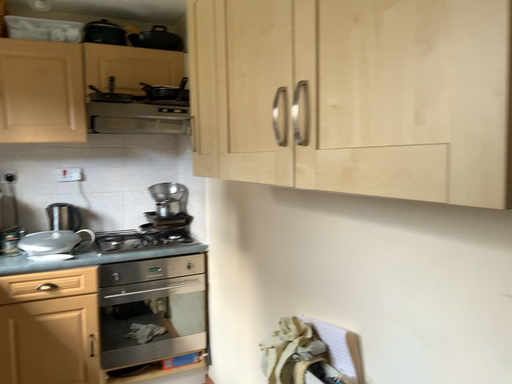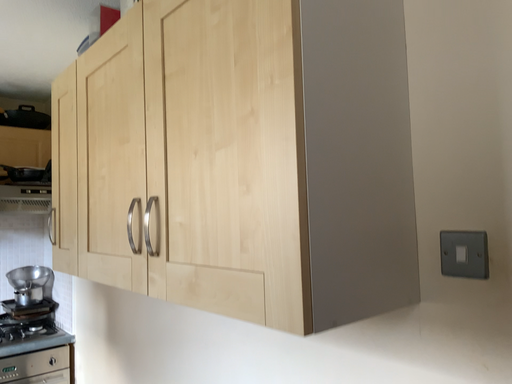
Question: How did the camera likely rotate when shooting the video?

Choices:
 (A) rotated downward
 (B) rotated upward

Answer: (B)